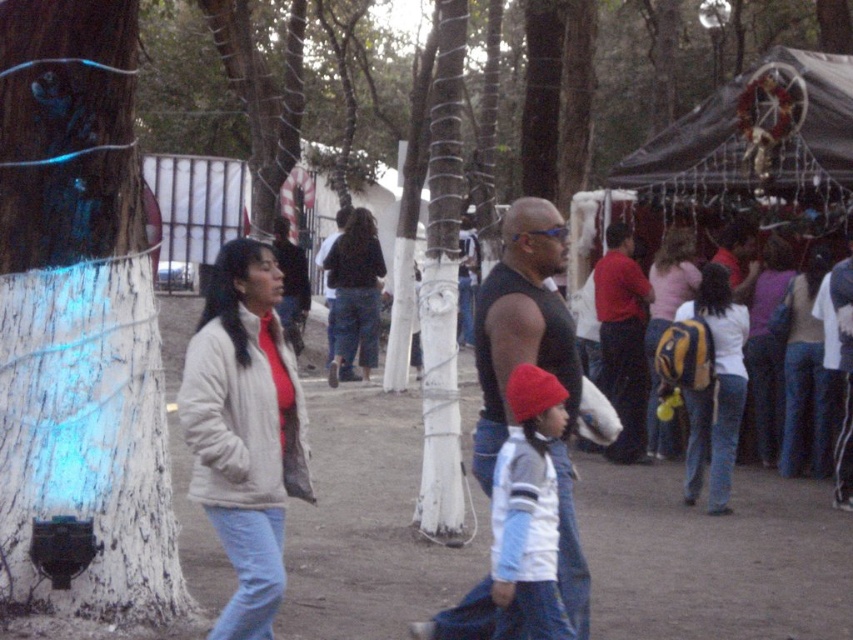
You are a photographer trying to capture a candid shot of the black muscle tank top at center and the yellow backpack at center right. Since you want to frame both in the same shot, can you tell me which one is on the left side so you can position your camera accordingly?

The black muscle tank top at center is positioned on the left side of yellow backpack at center right, so you should position your camera to include both by focusing on the left side for the black muscle tank top at center and the right side for the yellow backpack at center right.

You are standing at the point labeled as point (32, 410) in the image. If you want to take a photo of the woman in the light beige jacket and the child in the white jacket with black accents, will you be able to capture both in the frame without moving? Please explain your reasoning based on the distance from the camera.

The distance of point (32, 410) from the camera is 4.81 meters. Since both the woman in the light beige jacket and the child in the white jacket with black accents are at this point, they will both be within the camera frame at this distance.